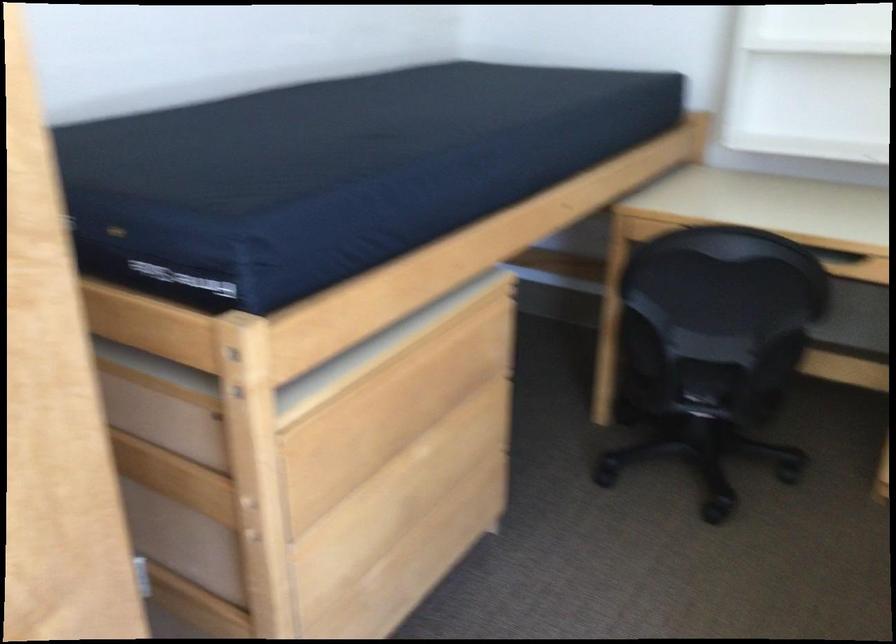
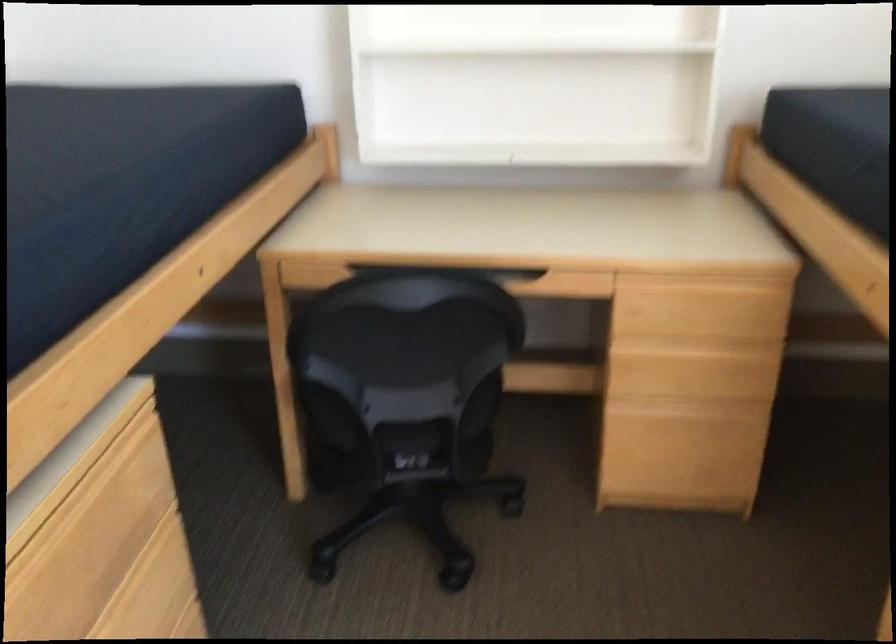
Question: How did the camera likely rotate?

Choices:
 (A) Left
 (B) Right
 (C) Up
 (D) Down

Answer: (B)